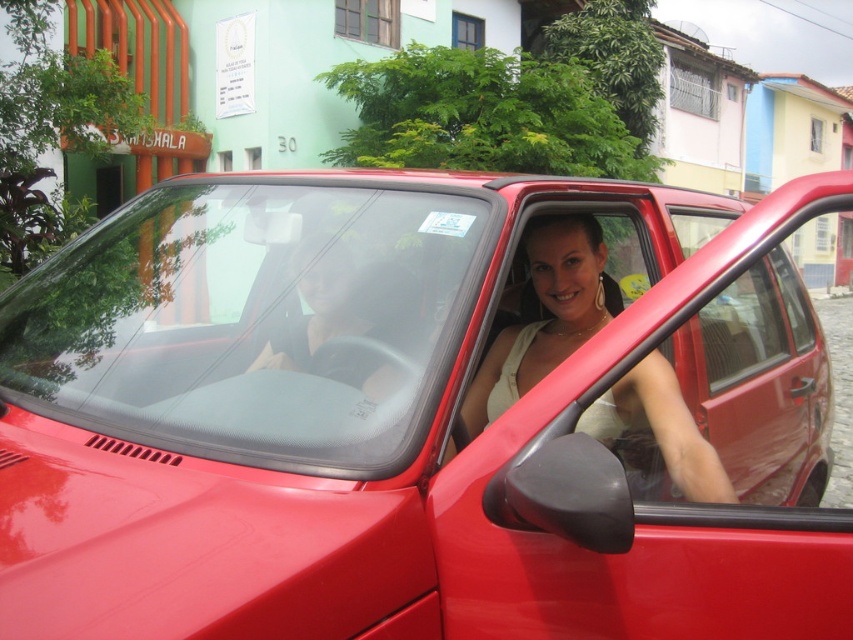
Is glossy red car at center bigger than matte black shirt at center?

No.

Who is more forward, (575, 412) or (331, 328)?

Point (575, 412) is in front.

Between point (769, 563) and point (386, 294), which one is positioned in front?

Point (769, 563) is more forward.

Image resolution: width=853 pixels, height=640 pixels. In order to click on glossy red car at center in this screenshot , I will do `click(422, 413)`.

Is point (526, 371) behind point (339, 317)?

Yes.

Who is lower down, matte white dress at center or matte black shirt at center?

matte white dress at center

Measure the distance between matte white dress at center and camera.

matte white dress at center and camera are 6.08 feet apart from each other.

Find the location of `matte white dress at center`. matte white dress at center is located at coordinates (544, 320).

Can you confirm if glossy red car at center is positioned to the right of transparent glass windshield at center?

Correct, you'll find glossy red car at center to the right of transparent glass windshield at center.

Does point (207, 564) come in front of point (190, 269)?

Yes, point (207, 564) is in front of point (190, 269).

The height and width of the screenshot is (640, 853). In order to click on glossy red car at center in this screenshot , I will do `click(422, 413)`.